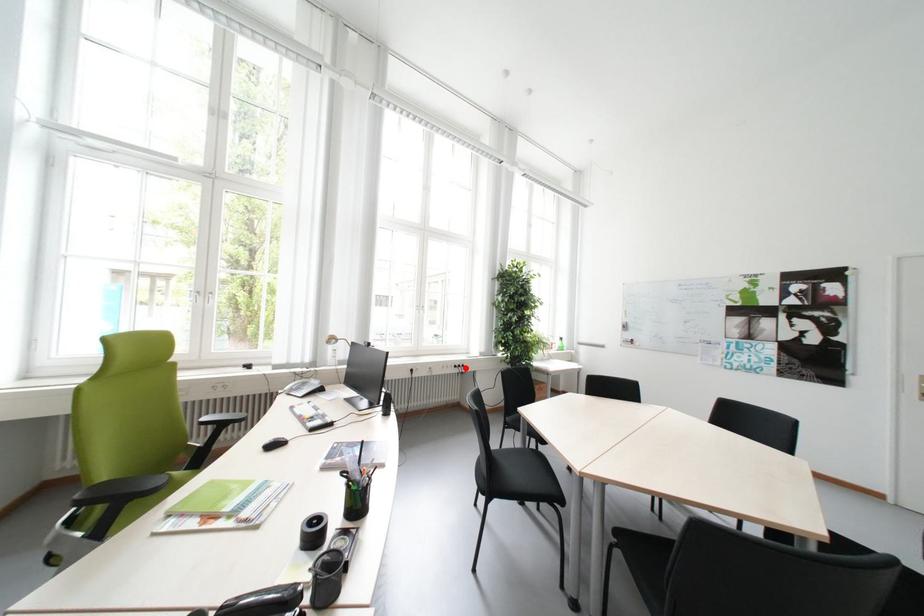
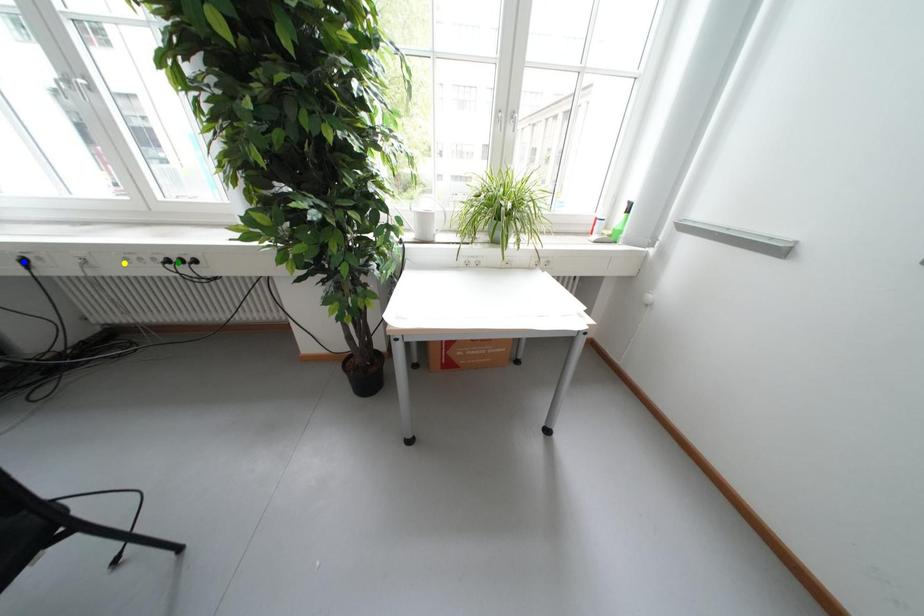
Question: I am providing you with two images of the same scene from different viewpoints. A red point is marked on the first image. You are given multiple points on the second image. Which point in image 2 represents the same 3d spot as the red point in image 1?

Choices:
 (A) green point
 (B) blue point
 (C) yellow point

Answer: (A)